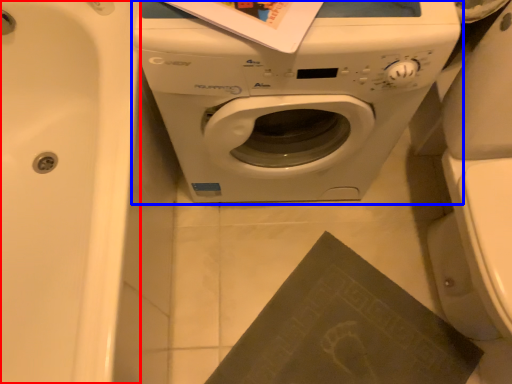
Question: Which of the following is the closest to the observer, bath (highlighted by a red box) or washing machine (highlighted by a blue box)?

Choices:
 (A) bath
 (B) washing machine

Answer: (A)